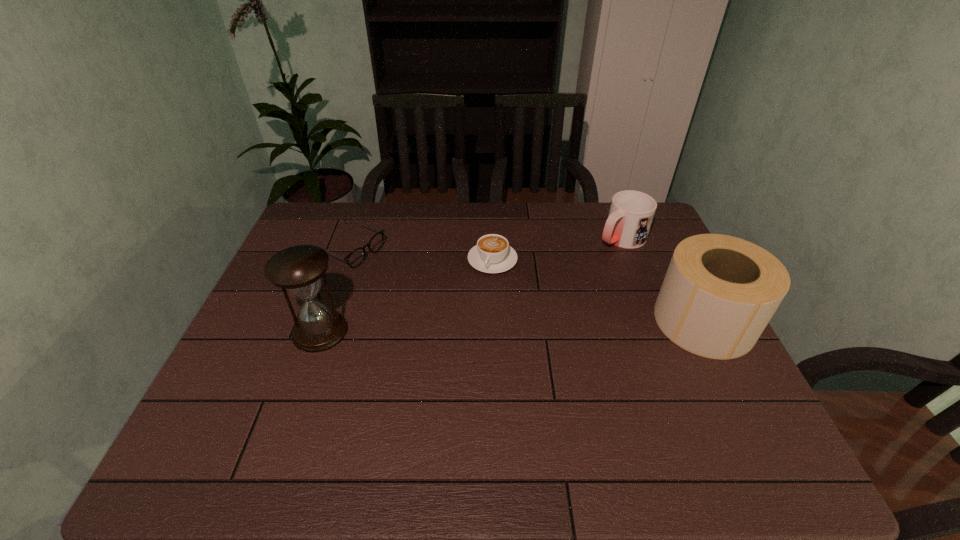
Locate an element on the screen. The width and height of the screenshot is (960, 540). hourglass is located at coordinates (298, 269).

Where is `the fourth shortest object`? the fourth shortest object is located at coordinates (719, 293).

Where is `cappuccino`? cappuccino is located at coordinates (492, 254).

Find the location of a particular element. spectacles is located at coordinates (355, 258).

Locate an element on the screen. the third tallest object is located at coordinates (631, 213).

This screenshot has height=540, width=960. Identify the location of vacant point located 0.120m on the front of the hourglass. (298, 394).

The image size is (960, 540). I want to click on vacant space located on the front of the second tallest object, so click(741, 395).

At what (x,y) coordinates should I click in order to perform the action: click on free location located 0.210m on the side of the cappuccino with the handle. Please return your answer as a coordinate pair (x, y). The height and width of the screenshot is (540, 960). Looking at the image, I should click on (462, 326).

You are a GUI agent. You are given a task and a screenshot of the screen. Output one action in this format:
    pyautogui.click(x=<x>, y=<y>)
    Task: Click on the vacant region located on the side of the cappuccino with the handle
    
    Given the screenshot: What is the action you would take?
    pyautogui.click(x=467, y=316)

At what (x,y) coordinates should I click in order to perform the action: click on free spot located on the side of the cappuccino with the handle. Please return your answer as a coordinate pair (x, y). The width and height of the screenshot is (960, 540). Looking at the image, I should click on (448, 355).